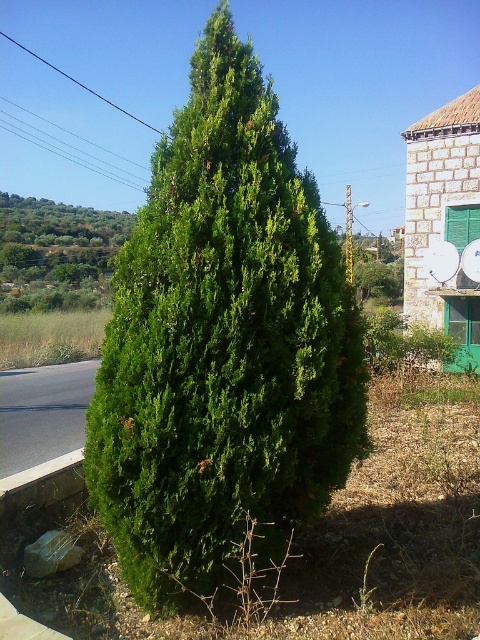
Question: Which point is closer to the camera?

Choices:
 (A) (80, 460)
 (B) (106, 225)

Answer: (A)

Question: Can you confirm if green leafy tree at upper left is smaller than gray concrete curb at lower left?

Choices:
 (A) no
 (B) yes

Answer: (A)

Question: Can you confirm if green leafy shrub at center is positioned to the left of green leafy tree at upper left?

Choices:
 (A) yes
 (B) no

Answer: (B)

Question: Where is green leafy shrub at center located in relation to gray concrete curb at lower left in the image?

Choices:
 (A) below
 (B) above

Answer: (B)

Question: Among these points, which one is nearest to the camera?

Choices:
 (A) (169, 563)
 (B) (21, 476)

Answer: (A)

Question: Which object appears farthest from the camera in this image?

Choices:
 (A) green leafy tree at upper left
 (B) gray concrete curb at lower left
 (C) green leafy shrub at center

Answer: (A)